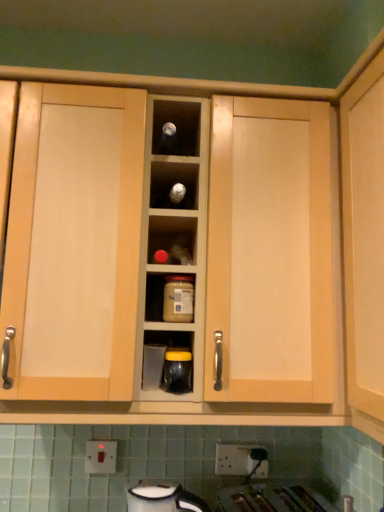
The height and width of the screenshot is (512, 384). Describe the element at coordinates (101, 457) in the screenshot. I see `white plastic electric outlet at lower center, which ranks as the 2th electric outlet in right-to-left order` at that location.

Locate an element on the screen. The height and width of the screenshot is (512, 384). light wood cabinet at center is located at coordinates (364, 245).

Describe the element at coordinates (364, 245) in the screenshot. I see `light wood cabinet at center` at that location.

What do you see at coordinates (163, 497) in the screenshot? I see `white glossy kettle at lower center, placed as the 1th appliance when sorted from bottom to top` at bounding box center [163, 497].

Where is `black glossy jar at center, the first appliance viewed from the top`? The width and height of the screenshot is (384, 512). black glossy jar at center, the first appliance viewed from the top is located at coordinates (177, 371).

Between point (260, 455) and point (169, 311), which one is positioned behind?

The point (260, 455) is more distant.

From a real-world perspective, is white plastic electric outlet at lower center, which appears as the 2th electric outlet when viewed from the left, physically above matte glass jar at center?

No.

Which object is wider, white plastic electric outlet at lower center, which appears as the first electric outlet when viewed from the right, or matte glass jar at center?

With larger width is matte glass jar at center.

What's the angular difference between white plastic electric outlet at lower center, which appears as the 2th electric outlet when viewed from the left, and matte glass jar at center's facing directions?

The facing directions of white plastic electric outlet at lower center, which appears as the 2th electric outlet when viewed from the left, and matte glass jar at center are 0.146 degrees apart.

From the image's perspective, which one is positioned higher, matte glass jar at center or light wood cabinet at center?

light wood cabinet at center appears higher in the image.

Between matte glass jar at center and light wood cabinet at center, which one has larger width?

light wood cabinet at center.

Looking at this image, can you confirm if black glossy jar at center, positioned as the third appliance in bottom-to-top order, is smaller than light wood cabinet at center?

Indeed, black glossy jar at center, positioned as the third appliance in bottom-to-top order, has a smaller size compared to light wood cabinet at center.

Is black glossy jar at center, positioned as the third appliance in bottom-to-top order, far from light wood cabinet at center?

No, black glossy jar at center, positioned as the third appliance in bottom-to-top order, is in close proximity to light wood cabinet at center.

Is black glossy jar at center, positioned as the third appliance in bottom-to-top order, wider or thinner than light wood cabinet at center?

Clearly, black glossy jar at center, positioned as the third appliance in bottom-to-top order, has less width compared to light wood cabinet at center.

From their relative heights in the image, would you say black glossy jar at center, the first appliance viewed from the top, is taller or shorter than light wood cabinet at center?

Clearly, black glossy jar at center, the first appliance viewed from the top, is shorter compared to light wood cabinet at center.

Is white glossy kettle at lower center, the third appliance in the top-to-bottom sequence, at the right side of matte glass jar at center?

No.

Is white glossy kettle at lower center, placed as the 1th appliance when sorted from bottom to top, oriented away from matte glass jar at center?

That's not correct — white glossy kettle at lower center, placed as the 1th appliance when sorted from bottom to top, is not looking away from matte glass jar at center.

Is white glossy kettle at lower center, placed as the 1th appliance when sorted from bottom to top, in front of or behind matte glass jar at center in the image?

white glossy kettle at lower center, placed as the 1th appliance when sorted from bottom to top, is behind matte glass jar at center.

Image resolution: width=384 pixels, height=512 pixels. Identify the location of the 3rd appliance behind the light wood cabinet at center, counting from the anchor's position. (153, 366).

Considering the relative sizes of matte plastic container at center, the 2th appliance viewed from the top, and light wood cabinet at center in the image provided, is matte plastic container at center, the 2th appliance viewed from the top, thinner than light wood cabinet at center?

Yes, matte plastic container at center, the 2th appliance viewed from the top, is thinner than light wood cabinet at center.

Can you confirm if matte plastic container at center, arranged as the second appliance when ordered from the bottom, is smaller than light wood cabinet at center?

Correct, matte plastic container at center, arranged as the second appliance when ordered from the bottom, occupies less space than light wood cabinet at center.

Is matte plastic container at center, the 2th appliance viewed from the top, looking in the opposite direction of white glossy kettle at lower center, placed as the 1th appliance when sorted from bottom to top?

matte plastic container at center, the 2th appliance viewed from the top, does not have its back to white glossy kettle at lower center, placed as the 1th appliance when sorted from bottom to top.

From the picture: Does matte plastic container at center, arranged as the second appliance when ordered from the bottom, have a lesser height compared to white glossy kettle at lower center, placed as the 1th appliance when sorted from bottom to top?

Correct, matte plastic container at center, arranged as the second appliance when ordered from the bottom, is not as tall as white glossy kettle at lower center, placed as the 1th appliance when sorted from bottom to top.

Based on the photo, can you confirm if matte plastic container at center, arranged as the second appliance when ordered from the bottom, is smaller than white glossy kettle at lower center, placed as the 1th appliance when sorted from bottom to top?

Yes.

Starting from the matte plastic container at center, the 2th appliance viewed from the top, which appliance is the 1st one in front? Please provide its 2D coordinates.

[(163, 497)]

Does point (160, 501) come farther from viewer compared to point (360, 321)?

Yes, it is behind point (360, 321).

From a real-world perspective, is white glossy kettle at lower center, the third appliance in the top-to-bottom sequence, located beneath light wood cabinet at center?

Correct, in the physical world, white glossy kettle at lower center, the third appliance in the top-to-bottom sequence, is lower than light wood cabinet at center.

Considering the sizes of white glossy kettle at lower center, placed as the 1th appliance when sorted from bottom to top, and light wood cabinet at center in the image, is white glossy kettle at lower center, placed as the 1th appliance when sorted from bottom to top, taller or shorter than light wood cabinet at center?

Considering their sizes, white glossy kettle at lower center, placed as the 1th appliance when sorted from bottom to top, has less height than light wood cabinet at center.

Where is `bottle in front of the white plastic electric outlet at lower center, which appears as the first electric outlet when viewed from the right`? bottle in front of the white plastic electric outlet at lower center, which appears as the first electric outlet when viewed from the right is located at coordinates (178, 298).

Locate an element on the screen. This screenshot has height=512, width=384. cabinetry lying on the right of matte glass jar at center is located at coordinates coord(364,245).

Which object lies nearer to the anchor point white plastic electric outlet at lower center, the 1th electric outlet in the left-to-right sequence, matte glass jar at center or black glossy jar at center, positioned as the third appliance in bottom-to-top order?

black glossy jar at center, positioned as the third appliance in bottom-to-top order.

Based on the photo, which object lies nearer to the anchor point matte glass jar at center, white plastic electric outlet at lower center, which ranks as the 2th electric outlet in right-to-left order, or black glossy jar at center, the first appliance viewed from the top?

The object closer to matte glass jar at center is black glossy jar at center, the first appliance viewed from the top.

Considering their positions, is matte glass jar at center positioned closer to matte plastic container at center, arranged as the second appliance when ordered from the bottom, than white plastic electric outlet at lower center, which appears as the 2th electric outlet when viewed from the left?

Based on the image, matte glass jar at center appears to be nearer to matte plastic container at center, arranged as the second appliance when ordered from the bottom.

When comparing their distances from white plastic electric outlet at lower center, which appears as the first electric outlet when viewed from the right, does white glossy kettle at lower center, the third appliance in the top-to-bottom sequence, or matte plastic container at center, the 2th appliance viewed from the top, seem further?

matte plastic container at center, the 2th appliance viewed from the top, lies further to white plastic electric outlet at lower center, which appears as the first electric outlet when viewed from the right, than the other object.

Considering their positions, is white glossy kettle at lower center, placed as the 1th appliance when sorted from bottom to top, positioned closer to white plastic electric outlet at lower center, the 1th electric outlet in the left-to-right sequence, than matte glass jar at center?

white glossy kettle at lower center, placed as the 1th appliance when sorted from bottom to top, lies closer to white plastic electric outlet at lower center, the 1th electric outlet in the left-to-right sequence, than the other object.

When comparing their distances from black glossy jar at center, positioned as the third appliance in bottom-to-top order, does white plastic electric outlet at lower center, which appears as the first electric outlet when viewed from the right, or white plastic electric outlet at lower center, the 1th electric outlet in the left-to-right sequence, seem closer?

The object closer to black glossy jar at center, positioned as the third appliance in bottom-to-top order, is white plastic electric outlet at lower center, which appears as the first electric outlet when viewed from the right.

Looking at the image, which one is located closer to white plastic electric outlet at lower center, the 1th electric outlet in the left-to-right sequence, white plastic electric outlet at lower center, which appears as the 2th electric outlet when viewed from the left, or matte glass jar at center?

white plastic electric outlet at lower center, which appears as the 2th electric outlet when viewed from the left, is positioned closer to the anchor white plastic electric outlet at lower center, the 1th electric outlet in the left-to-right sequence.

Based on their spatial positions, is white plastic electric outlet at lower center, which appears as the 2th electric outlet when viewed from the left, or black glossy jar at center, the first appliance viewed from the top, further from matte glass jar at center?

white plastic electric outlet at lower center, which appears as the 2th electric outlet when viewed from the left, is positioned further to the anchor matte glass jar at center.

What are the coordinates of `appliance between black glossy jar at center, positioned as the third appliance in bottom-to-top order, and white glossy kettle at lower center, the third appliance in the top-to-bottom sequence, in the up-down direction` in the screenshot? It's located at (153, 366).

At what (x,y) coordinates should I click in order to perform the action: click on bottle between light wood cabinet at center and white glossy kettle at lower center, placed as the 1th appliance when sorted from bottom to top, in the up-down direction. Please return your answer as a coordinate pair (x, y). The width and height of the screenshot is (384, 512). Looking at the image, I should click on [178, 298].

Identify the location of electric outlet between matte glass jar at center and white plastic electric outlet at lower center, which appears as the first electric outlet when viewed from the right, in the up-down direction. (101, 457).

At what (x,y) coordinates should I click in order to perform the action: click on electric outlet between light wood cabinet at center and white plastic electric outlet at lower center, which appears as the first electric outlet when viewed from the right, in the vertical direction. Please return your answer as a coordinate pair (x, y). The image size is (384, 512). Looking at the image, I should click on (101, 457).